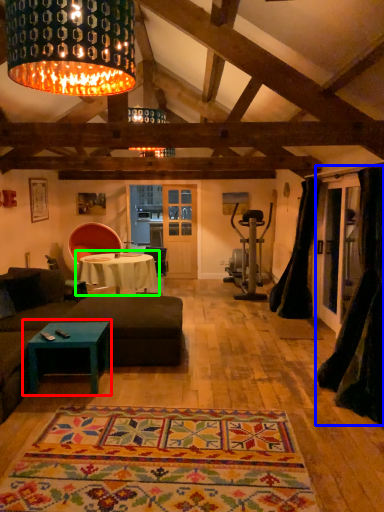
Question: Based on their relative distances, which object is nearer to coffee table (highlighted by a red box)? Choose from curtain (highlighted by a blue box) and table (highlighted by a green box).

Choices:
 (A) curtain
 (B) table

Answer: (A)